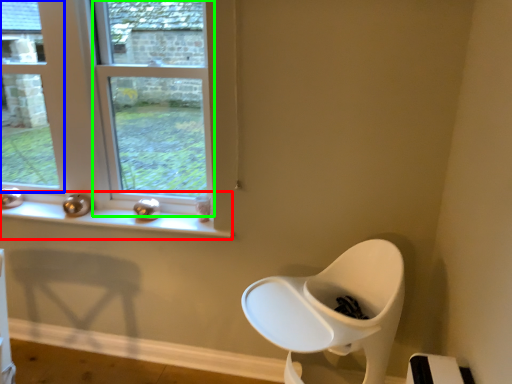
Question: Which object is the farthest from window sill (highlighted by a red box)? Choose among these: window (highlighted by a blue box) or window (highlighted by a green box).

Choices:
 (A) window
 (B) window

Answer: (A)